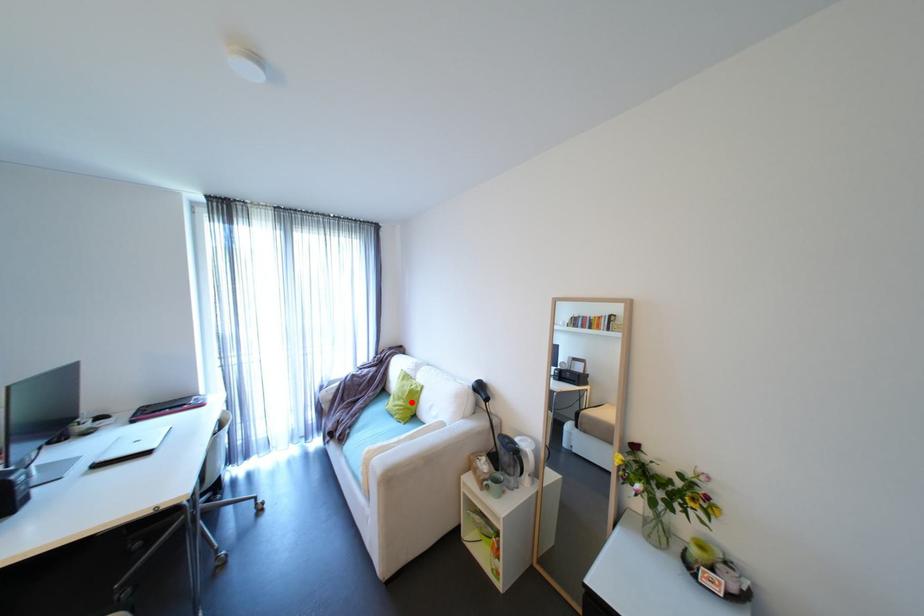
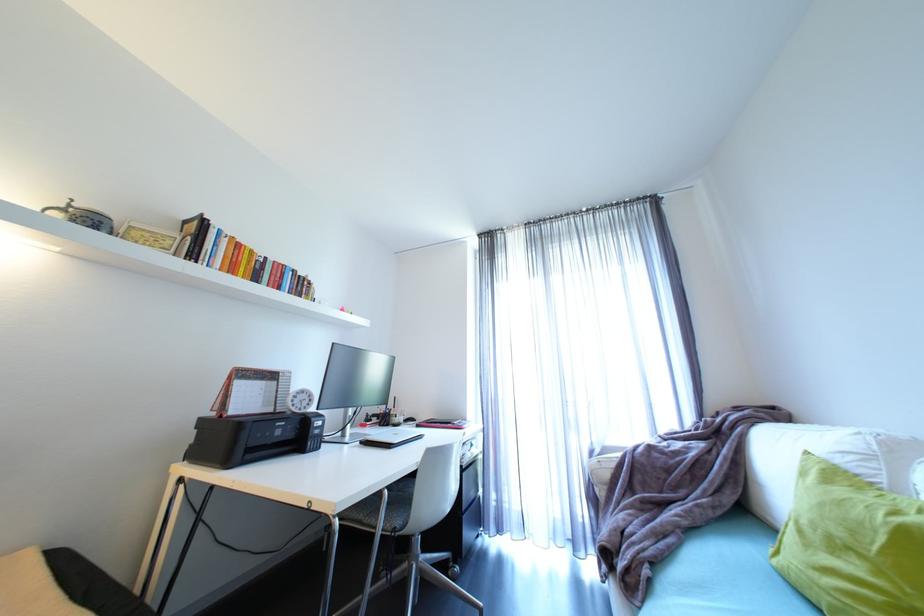
In the second image, find the point that corresponds to the highlighted location in the first image.

(885, 573)